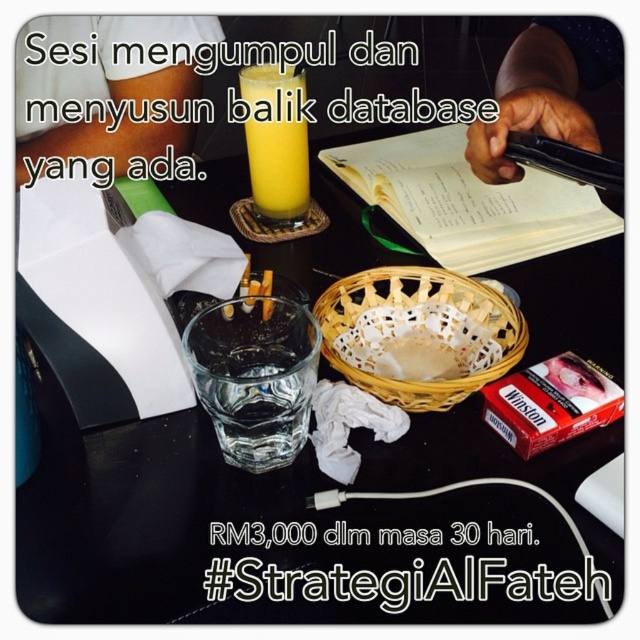
Which is behind, point (483, 596) or point (244, 88)?

Point (244, 88)

Can you confirm if white paper at center is positioned to the left of translucent glass of orange juice at center?

Incorrect, white paper at center is not on the left side of translucent glass of orange juice at center.

Which is behind, point (269, 564) or point (252, 84)?

The point (252, 84) is more distant.

I want to click on white paper at center, so click(x=403, y=582).

Between point (243, 356) and point (332, 579), which one is positioned behind?

The point (243, 356) is behind.

Is transparent glass at center to the left of white paper at center from the viewer's perspective?

Yes, transparent glass at center is to the left of white paper at center.

Is point (253, 403) closer to camera compared to point (445, 570)?

No, it is not.

The height and width of the screenshot is (640, 640). In order to click on transparent glass at center in this screenshot , I will do `click(253, 376)`.

Can you confirm if black glass at center is taller than translucent glass of orange juice at center?

Indeed, black glass at center has a greater height compared to translucent glass of orange juice at center.

Measure the distance from black glass at center to translucent glass of orange juice at center.

A distance of 7.20 inches exists between black glass at center and translucent glass of orange juice at center.

Between point (205, 612) and point (266, 147), which one is positioned behind?

The point (266, 147) is behind.

This screenshot has height=640, width=640. Identify the location of black glass at center. (221, 524).